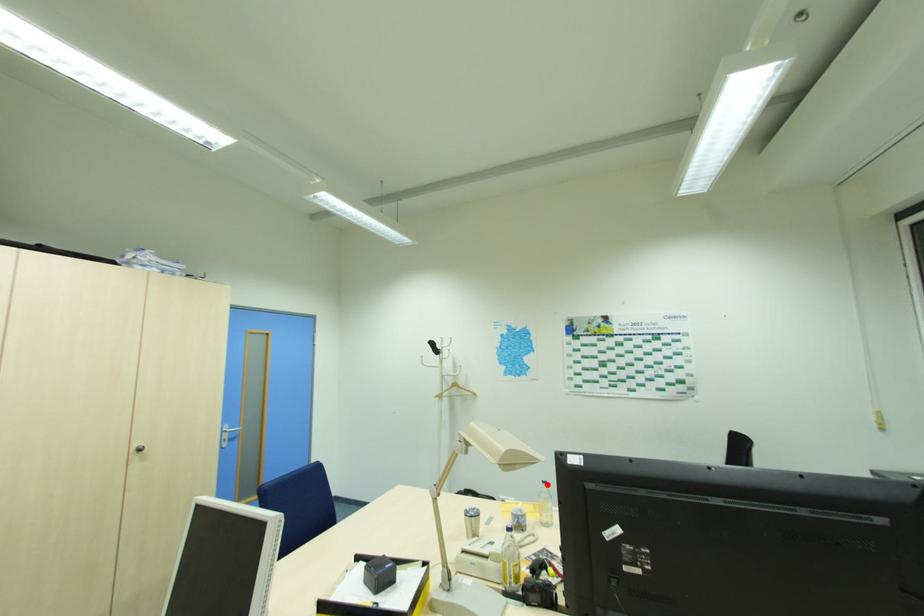
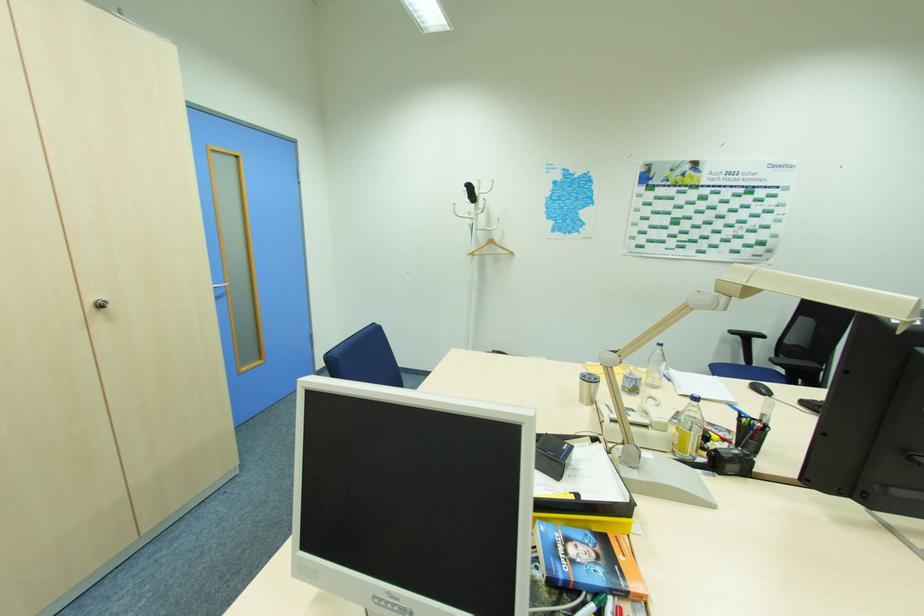
Question: I am providing you with two images of the same scene from different viewpoints. A red point is shown in image1. For the corresponding object point in image2, is it positioned nearer or farther from the camera?

Choices:
 (A) Nearer
 (B) Farther

Answer: (A)